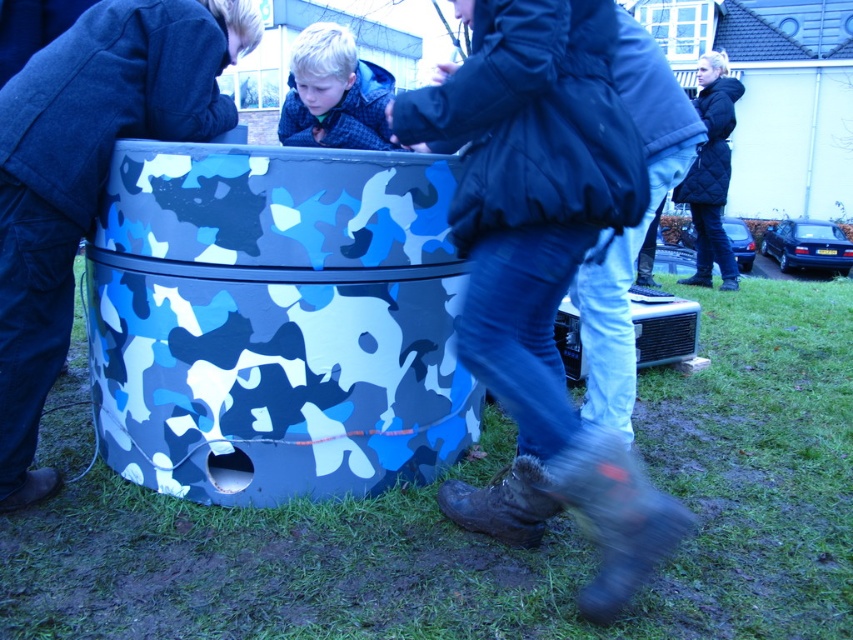
You are a photographer trying to capture both the dark blue puffy jacket at center and the quilted black jacket at upper right in the same frame. Which jacket should you focus on first to ensure both are in focus, considering their sizes?

The dark blue puffy jacket at center has a smaller size compared to quilted black jacket at upper right, so you should focus on the quilted black jacket at upper right first to ensure both are in focus since it is larger and might require more attention in the frame.

You are standing at the center of the scene. There is a dark blue puffy jacket at center. Is there any object located exactly at point (543, 268)?

Yes, at point (543, 268) lies the dark blue puffy jacket at center.

You are a photographer trying to capture both the dark blue puffy jacket at center and the quilted black jacket at upper right in a single frame. Your camera has a maximum focus range of 4 meters. Can you fit both subjects within the camera frame without moving closer or farther away?

The dark blue puffy jacket at center and quilted black jacket at upper right are 4.19 meters apart from each other, which exceeds the camera maximum focus range of 4 meters. Therefore, you cannot fit both subjects within the camera frame without adjusting your position.